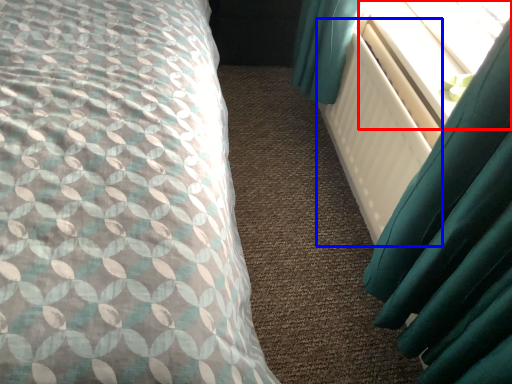
Question: Which object is closer to the camera taking this photo, window screen (highlighted by a red box) or radiator (highlighted by a blue box)?

Choices:
 (A) window screen
 (B) radiator

Answer: (B)